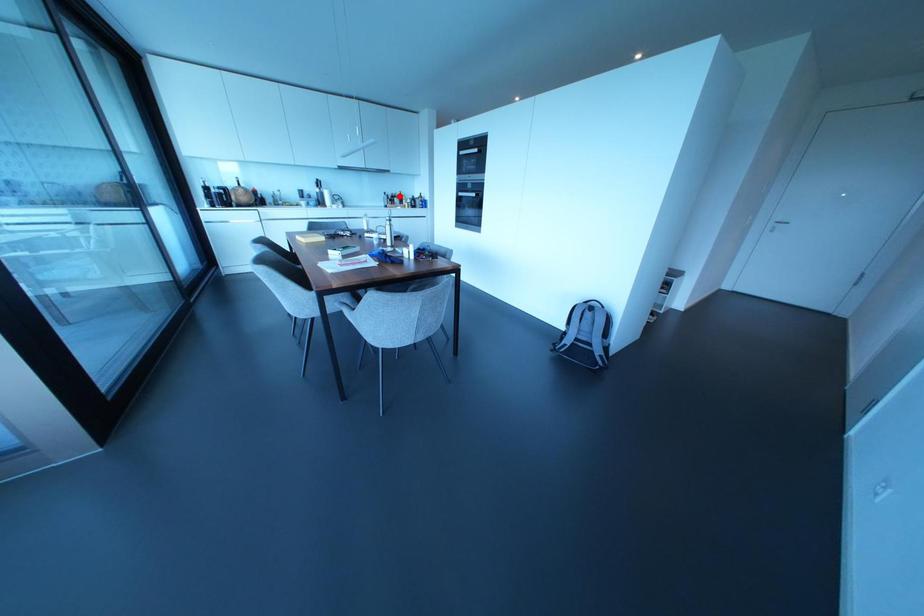
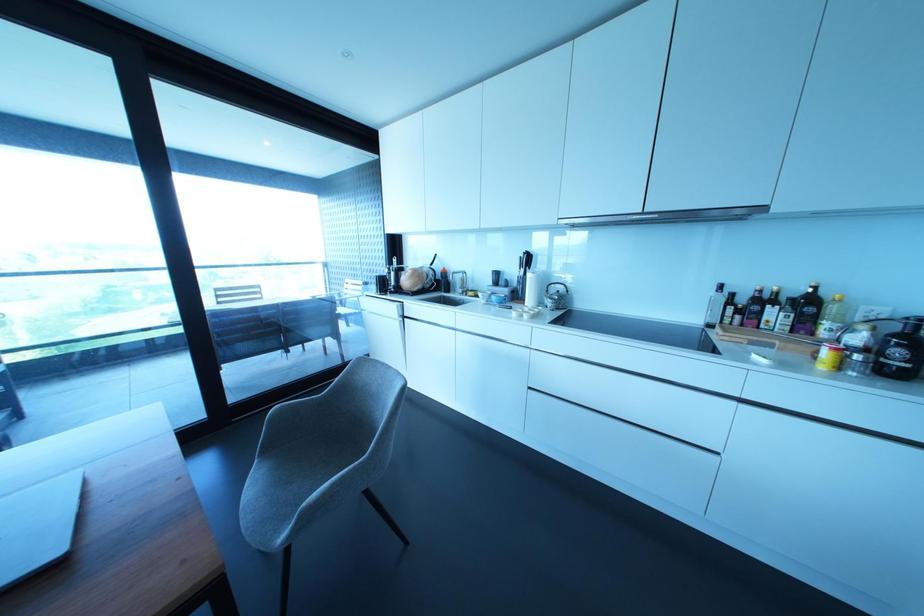
Question: I am providing you with two images of the same scene from different viewpoints. Image1 has a red point marked. In image2, the corresponding 3D location appears at what relative position? Reply with the corresponding letter.

Choices:
 (A) Closer
 (B) Farther

Answer: (B)